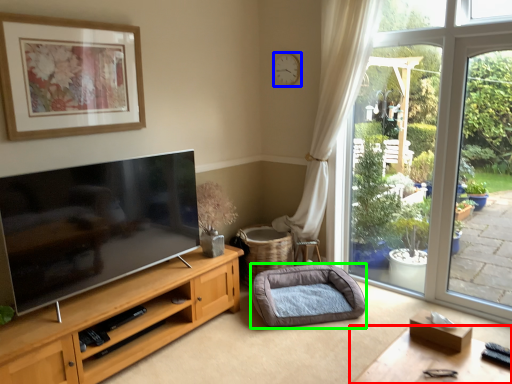
Question: Based on their relative distances, which object is farther from table (highlighted by a red box)? Choose from clock (highlighted by a blue box) and dog bed (highlighted by a green box).

Choices:
 (A) clock
 (B) dog bed

Answer: (A)